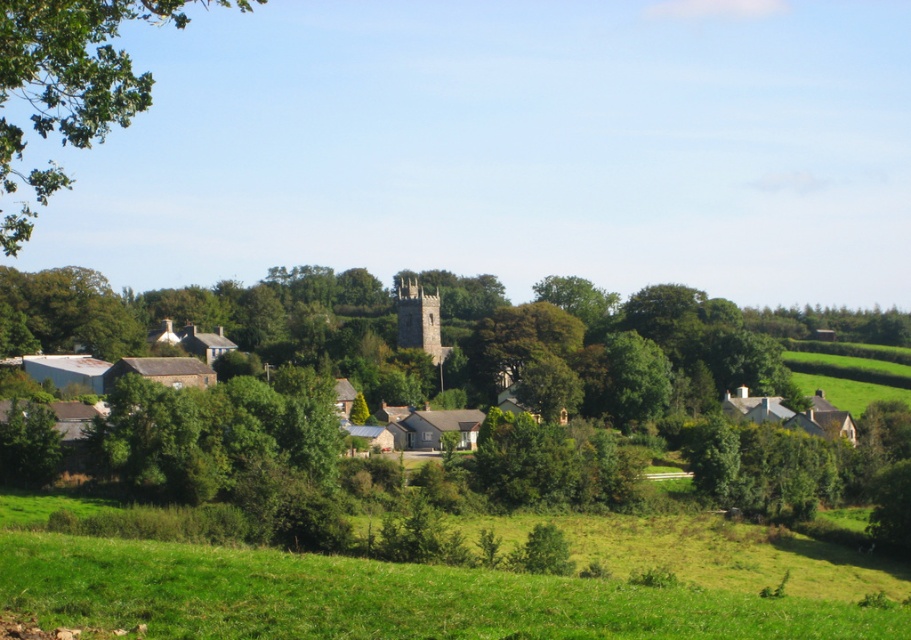
You are standing at the center of the image and want to walk to the green grassy field at lower center. Which direction should you move?

The green grassy field at lower center is located at point coordinates, so you should move downward from the center to reach it.

You are standing on the green grassy field at lower center and looking towards the green leafy tree at upper left. Is the tree above or below your current position?

The green leafy tree at upper left is above your current position because the green grassy field at lower center is positioned under it.